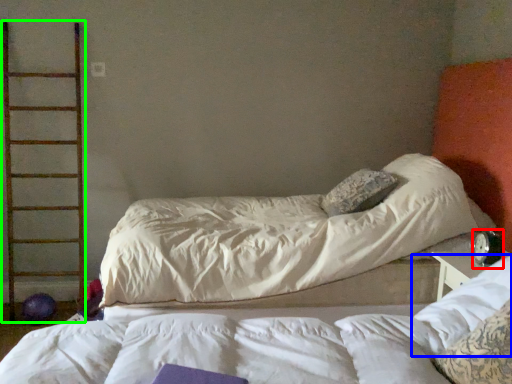
Question: Which object is positioned closest to alarm clock (highlighted by a red box)? Select from pillow (highlighted by a blue box) and ladder (highlighted by a green box).

Choices:
 (A) pillow
 (B) ladder

Answer: (A)